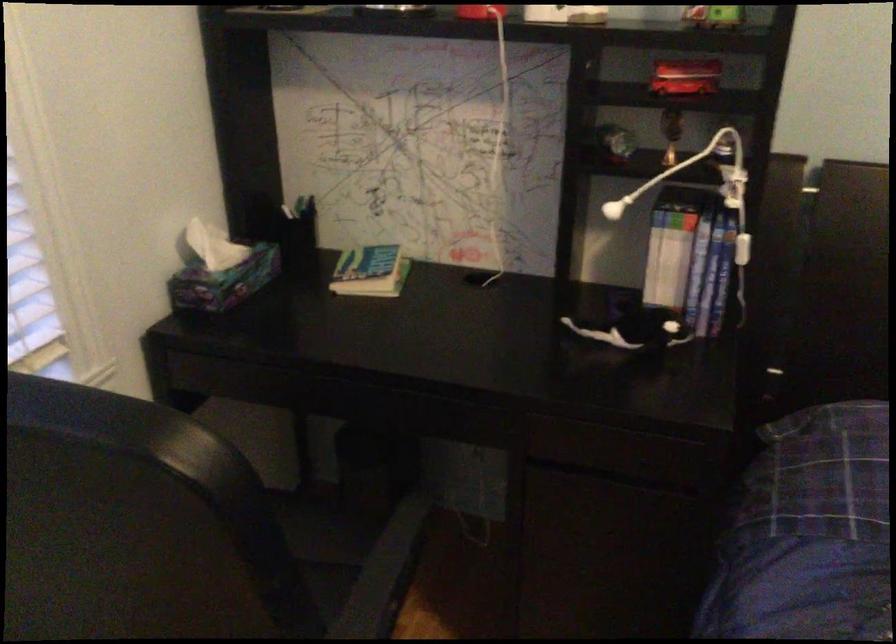
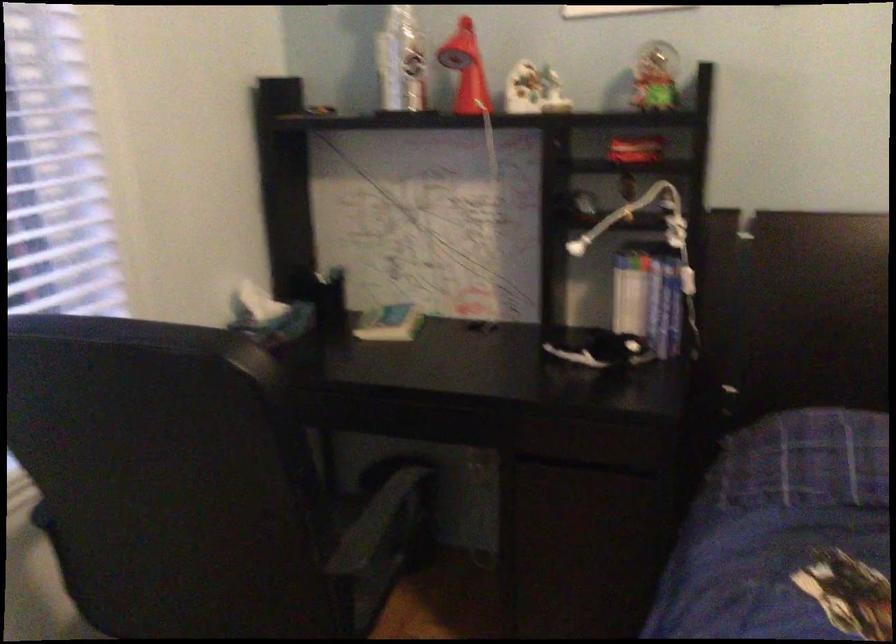
Locate, in the second image, the point that corresponds to (660,265) in the first image.

(629, 301)